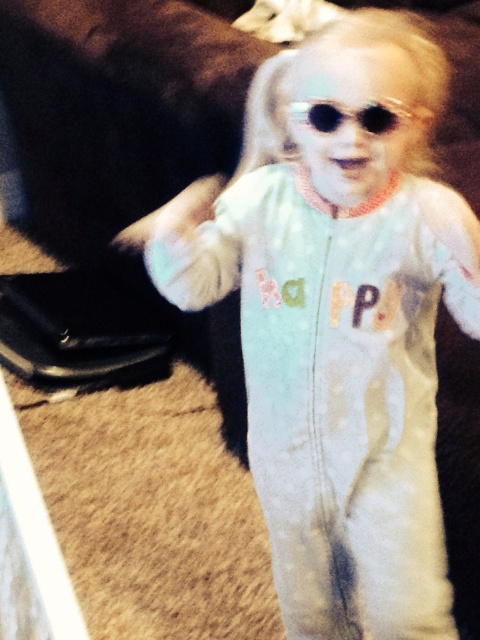
Can you confirm if white soft onesie at center is taller than sunglasses at center?

Yes, white soft onesie at center is taller than sunglasses at center.

Which is in front, point (335, 132) or point (298, 104)?

Point (335, 132) is more forward.

Describe the element at coordinates (340, 326) in the screenshot. I see `white soft onesie at center` at that location.

This screenshot has width=480, height=640. I want to click on white soft onesie at center, so click(x=340, y=326).